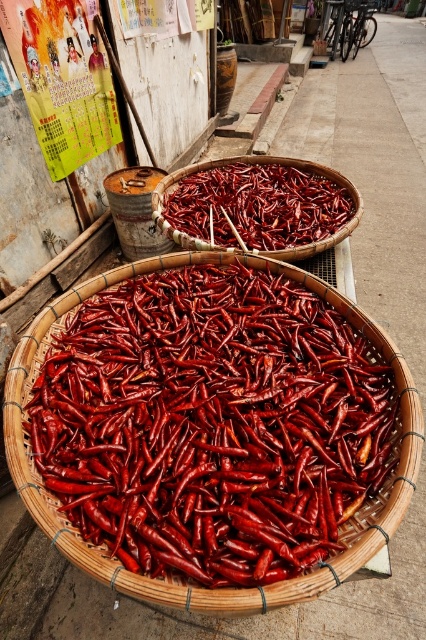
Question: Among these objects, which one is nearest to the camera?

Choices:
 (A) bright red dried chili peppers at center
 (B) smooth bamboo basket at center

Answer: (B)

Question: Which point is farther from the camera taking this photo?

Choices:
 (A) (330, 198)
 (B) (36, 369)

Answer: (A)

Question: Can you confirm if smooth bamboo basket at center is smaller than bright red dried chili peppers at center?

Choices:
 (A) yes
 (B) no

Answer: (B)

Question: Does smooth bamboo basket at center have a larger size compared to bright red dried chili peppers at center?

Choices:
 (A) yes
 (B) no

Answer: (A)

Question: Is smooth bamboo basket at center below bright red dried chili peppers at center?

Choices:
 (A) yes
 (B) no

Answer: (A)